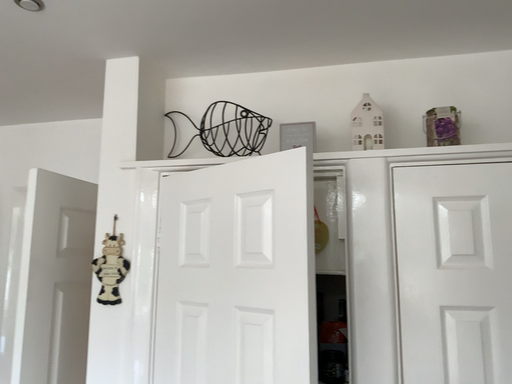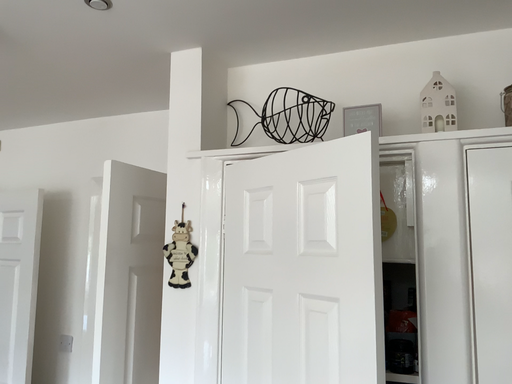
Question: How did the camera likely rotate when shooting the video?

Choices:
 (A) rotated right
 (B) rotated left

Answer: (B)